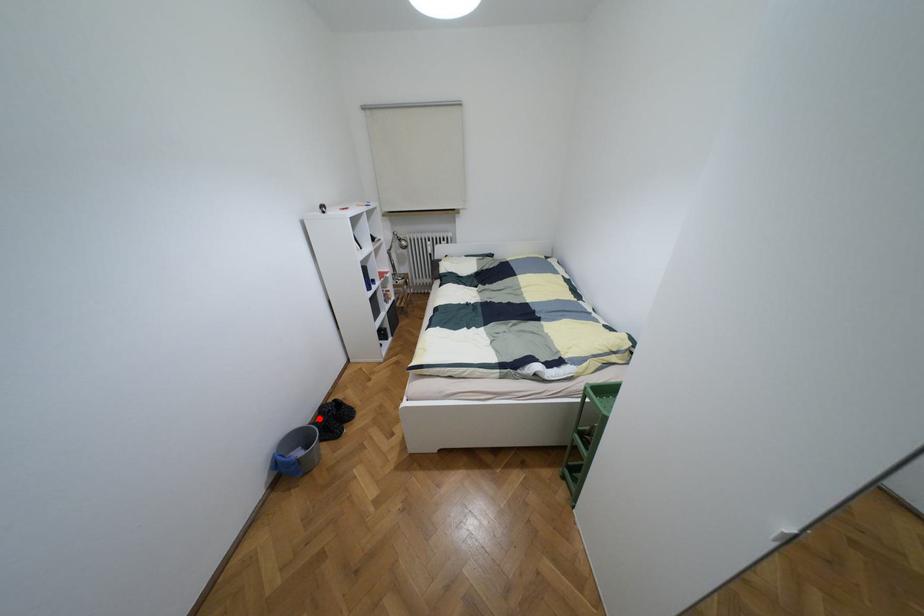
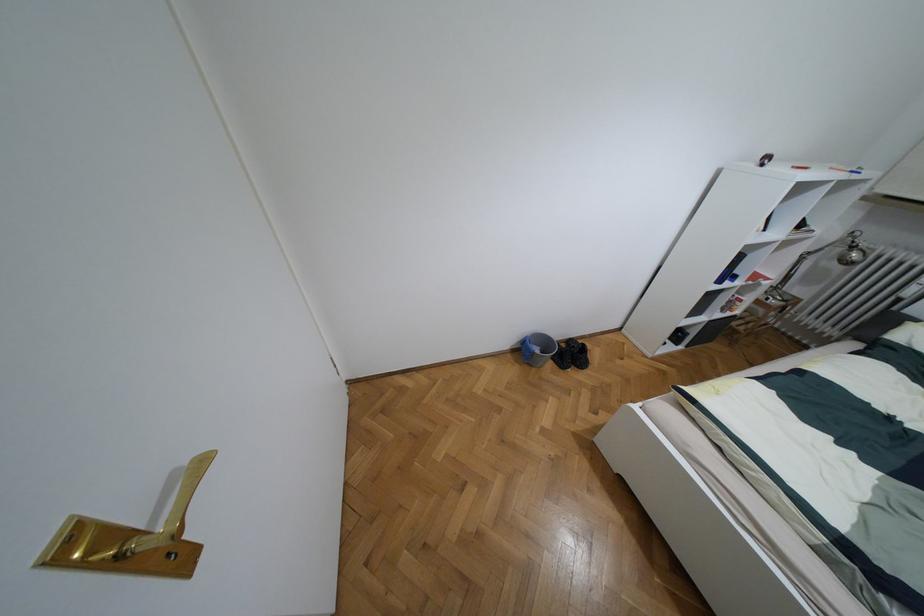
Question: I am providing you with two images of the same scene from different viewpoints. A red point is shown in image1. For the corresponding object point in image2, is it positioned nearer or farther from the camera?

Choices:
 (A) Nearer
 (B) Farther

Answer: (B)